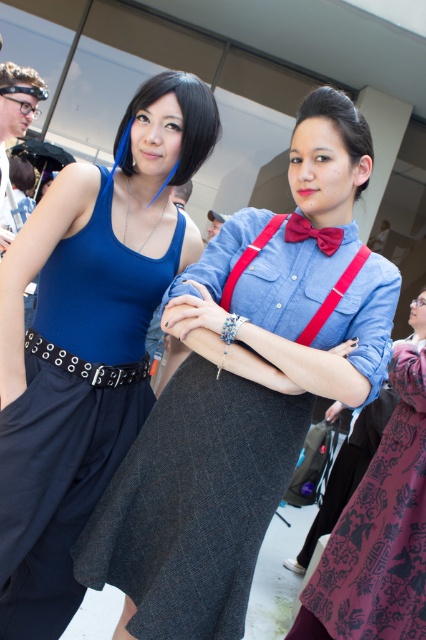
Question: Which point appears closest to the camera in this image?

Choices:
 (A) tap(160, 93)
 (B) tap(196, 378)
 (C) tap(146, 376)
 (D) tap(63, 468)

Answer: (B)

Question: Is matte blue tank top at center bigger than dark purple textured dress at center?

Choices:
 (A) no
 (B) yes

Answer: (B)

Question: Is dark purple textured dress at center above smooth brown hair at center?

Choices:
 (A) no
 (B) yes

Answer: (A)

Question: Which object is closer to the camera taking this photo?

Choices:
 (A) matte blue tank top at center
 (B) black leather belt at lower left
 (C) smooth blue hair at center

Answer: (A)

Question: Is matte blue dress at center to the right of smooth blue hair at center from the viewer's perspective?

Choices:
 (A) yes
 (B) no

Answer: (A)

Question: Which point is closer to the camera?

Choices:
 (A) smooth brown hair at center
 (B) smooth blue hair at center
 (C) matte blue dress at center
 (D) matte blue tank top at center

Answer: (C)